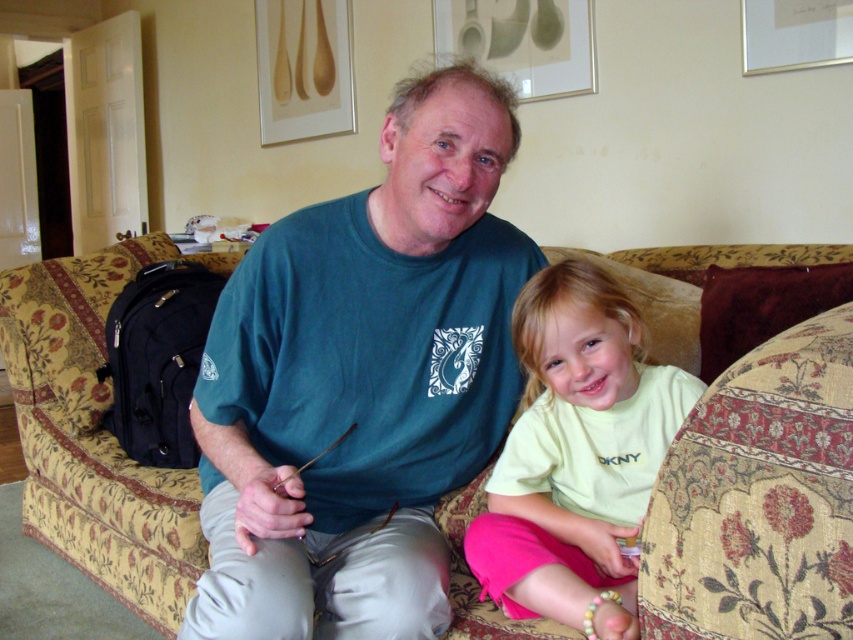
Question: Is floral-patterned fabric couch at center further to camera compared to light yellow cotton shirt at center?

Choices:
 (A) yes
 (B) no

Answer: (A)

Question: In this image, where is teal cotton t-shirt at center located relative to white matte picture frame at upper right?

Choices:
 (A) above
 (B) below

Answer: (B)

Question: Based on their relative distances, which object is nearer to the gold-framed artwork at upper center?

Choices:
 (A) white matte picture frame at upper right
 (B) floral-patterned fabric couch at center
 (C) teal cotton t-shirt at center

Answer: (A)

Question: Which point is closer to the camera?

Choices:
 (A) white matte picture frame at upper right
 (B) floral-patterned fabric couch at center

Answer: (B)

Question: Can you confirm if light yellow cotton shirt at center is positioned to the left of gold-framed artwork at upper center?

Choices:
 (A) yes
 (B) no

Answer: (B)

Question: Which point appears farthest from the camera in this image?

Choices:
 (A) (711, 477)
 (B) (807, 67)

Answer: (B)